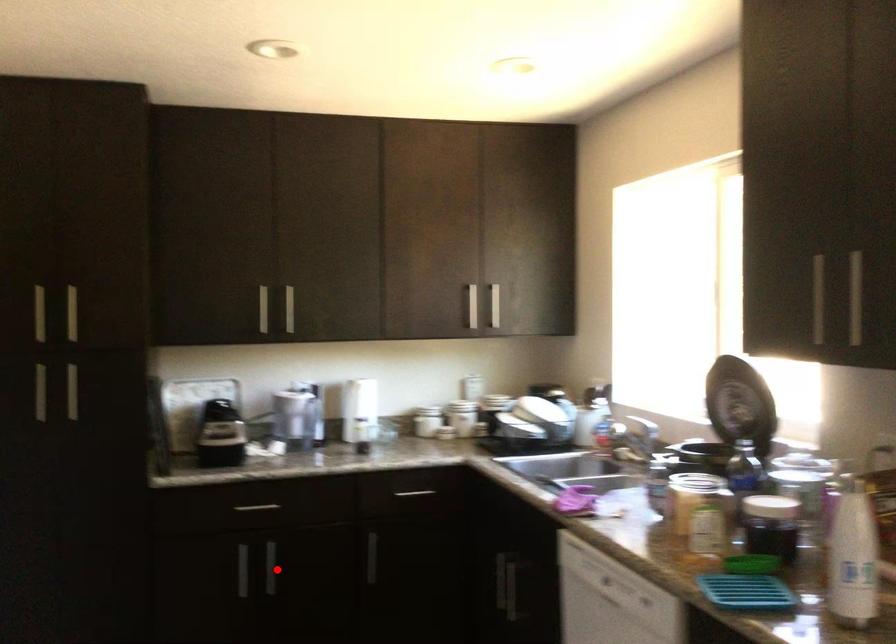
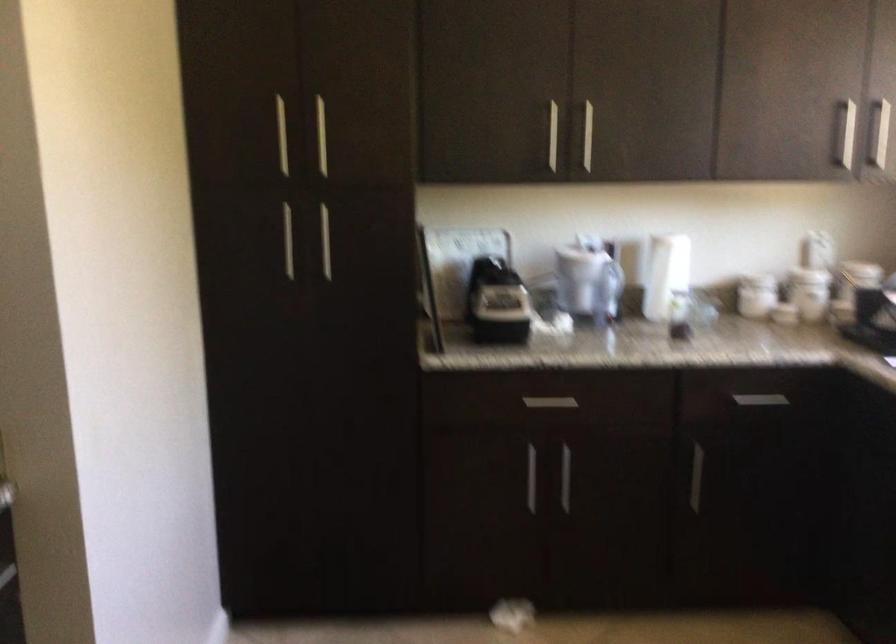
Question: I am providing you with two images of the same scene from different viewpoints. In image1, a red point is highlighted. Considering the same 3D point in image2, which of the following is correct?

Choices:
 (A) It is closer
 (B) It is farther

Answer: (A)